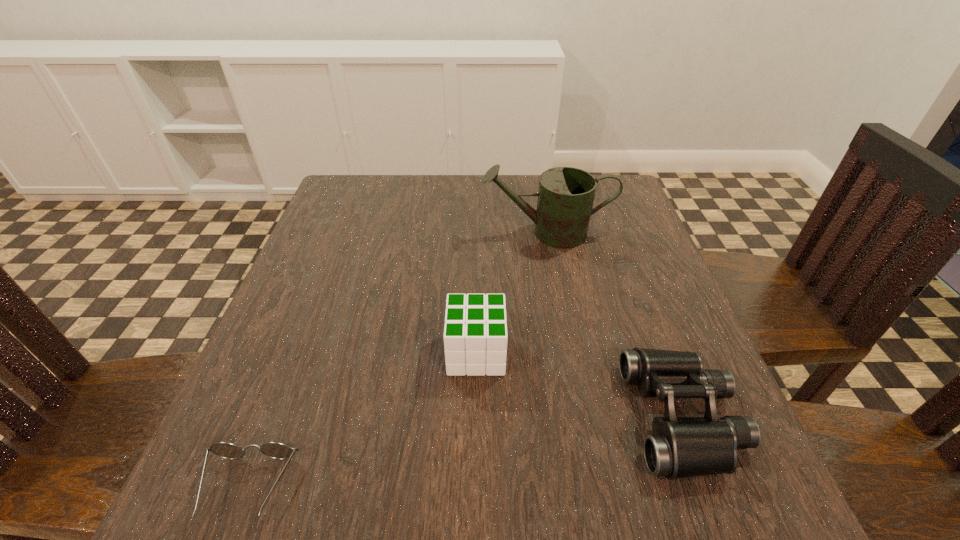
The width and height of the screenshot is (960, 540). What are the coordinates of `the farthest object` in the screenshot? It's located at (566, 195).

What are the coordinates of `watering can` in the screenshot? It's located at (566, 195).

At what (x,y) coordinates should I click in order to perform the action: click on cube. Please return your answer as a coordinate pair (x, y). Image resolution: width=960 pixels, height=540 pixels. Looking at the image, I should click on click(475, 337).

Identify the location of binoculars. This screenshot has width=960, height=540. (680, 447).

Where is `the shortest object`? the shortest object is located at coordinates (276, 450).

Identify the location of the leftmost object. Image resolution: width=960 pixels, height=540 pixels. (276, 450).

Where is `blank area located 0.080m with the spout on the tallest object`? This screenshot has width=960, height=540. blank area located 0.080m with the spout on the tallest object is located at coordinates (447, 233).

The width and height of the screenshot is (960, 540). Identify the location of free space located with the spout on the tallest object. (413, 233).

At what (x,y) coordinates should I click in order to perform the action: click on vacant region located 0.290m with the spout on the tallest object. Please return your answer as a coordinate pair (x, y). Looking at the image, I should click on (357, 233).

This screenshot has width=960, height=540. Identify the location of blank area located on the red face of the cube. (630, 353).